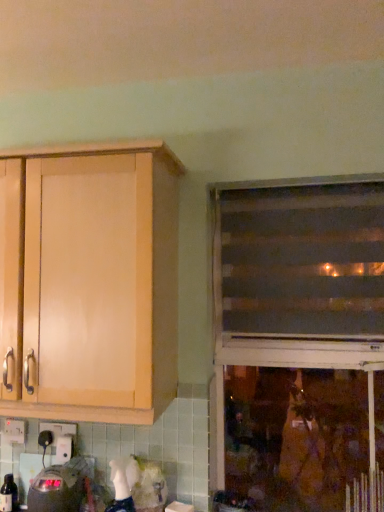
Question: From a real-world perspective, is brown striped blinds at right, which is the second window from bottom to top, above or below black plastic electric outlet at lower left, which ranks as the second electric outlet in left-to-right order?

Choices:
 (A) below
 (B) above

Answer: (B)

Question: From the image's perspective, is brown striped blinds at right, positioned as the first window in top-to-bottom order, positioned above or below black plastic electric outlet at lower left, the 1th electric outlet when ordered from right to left?

Choices:
 (A) below
 (B) above

Answer: (B)

Question: Which of these objects is positioned farthest from the brown striped blinds at right, positioned as the first window in top-to-bottom order?

Choices:
 (A) white plastic electric outlet at lower left, the first electric outlet from the left
 (B) matte wooden window at right, marked as the second window in a top-to-bottom arrangement
 (C) light wood cabinet at upper left
 (D) matte black digital clock at lower left
 (E) translucent glass bottle at lower left

Answer: (E)

Question: Estimate the real-world distances between objects in this image. Which object is closer to the metallic silver radiator at lower right?

Choices:
 (A) black plastic electric outlet at lower left, the 1th electric outlet when ordered from right to left
 (B) matte black digital clock at lower left
 (C) matte wooden window at right, marked as the second window in a top-to-bottom arrangement
 (D) translucent glass bottle at lower left
 (E) brown striped blinds at right, positioned as the first window in top-to-bottom order

Answer: (C)